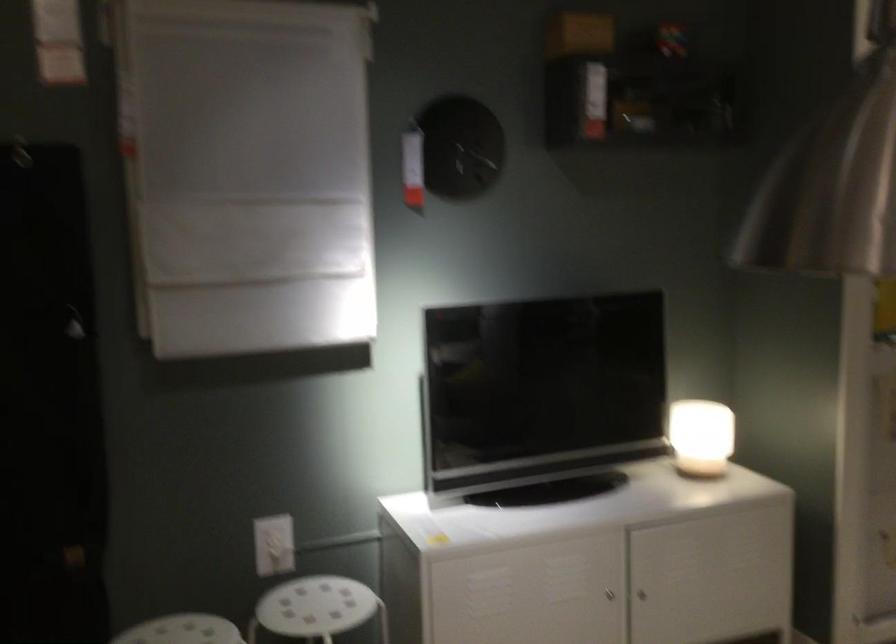
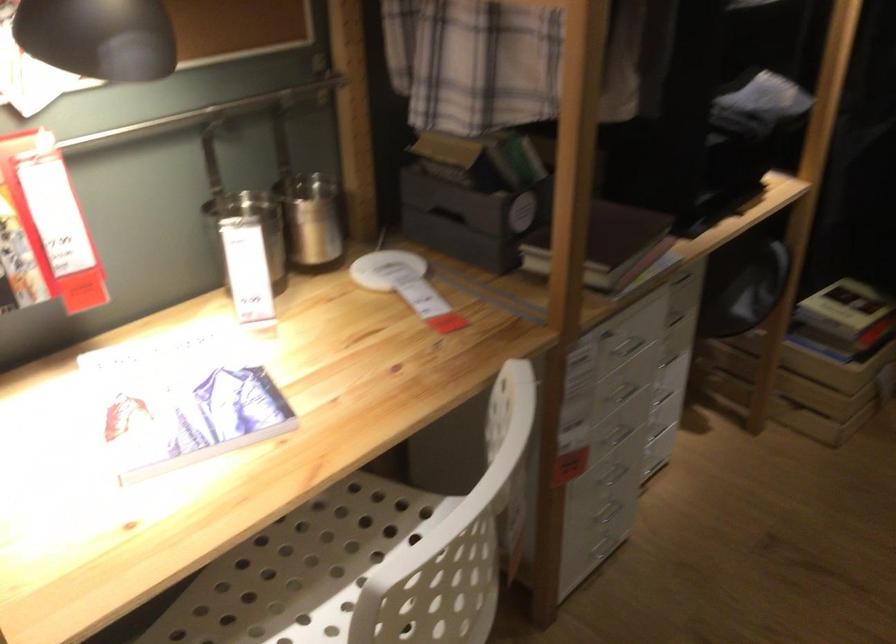
The first image is from the beginning of the video and the second image is from the end. How did the camera likely rotate when shooting the video?

The camera rotated toward left-down.